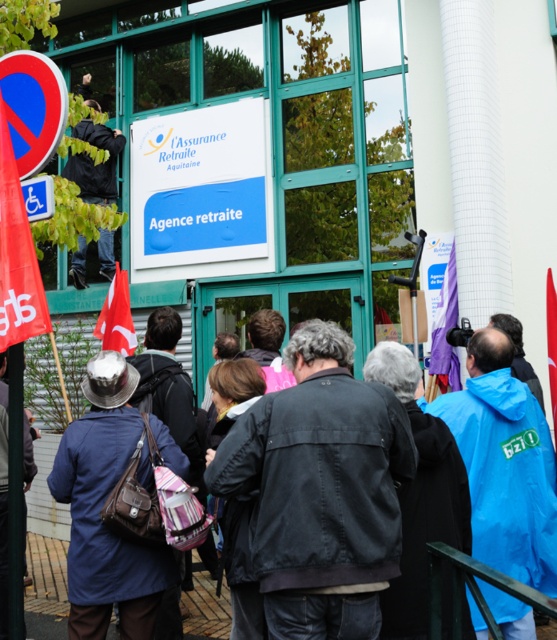
Does point (163, 182) lie behind point (23, 314)?

Yes.

In the scene shown: Can you confirm if white plastic sign at upper center is positioned to the left of red fabric flag at left?

In fact, white plastic sign at upper center is to the right of red fabric flag at left.

The height and width of the screenshot is (640, 557). What do you see at coordinates (201, 189) in the screenshot? I see `white plastic sign at upper center` at bounding box center [201, 189].

Locate an element on the screen. This screenshot has height=640, width=557. white plastic sign at upper center is located at coordinates (201, 189).

Does dark blue jacket at center have a smaller size compared to black leather jacket at upper left?

No, dark blue jacket at center is not smaller than black leather jacket at upper left.

The height and width of the screenshot is (640, 557). In order to click on dark blue jacket at center in this screenshot , I will do `click(46, 552)`.

Find the location of `dark blue jacket at center`. dark blue jacket at center is located at coordinates (46, 552).

Can you confirm if dark blue jacket at center is bigger than red plastic sign at upper left?

Indeed, dark blue jacket at center has a larger size compared to red plastic sign at upper left.

Is dark blue jacket at center shorter than red plastic sign at upper left?

Incorrect, dark blue jacket at center's height does not fall short of red plastic sign at upper left's.

The image size is (557, 640). Identify the location of dark blue jacket at center. (46, 552).